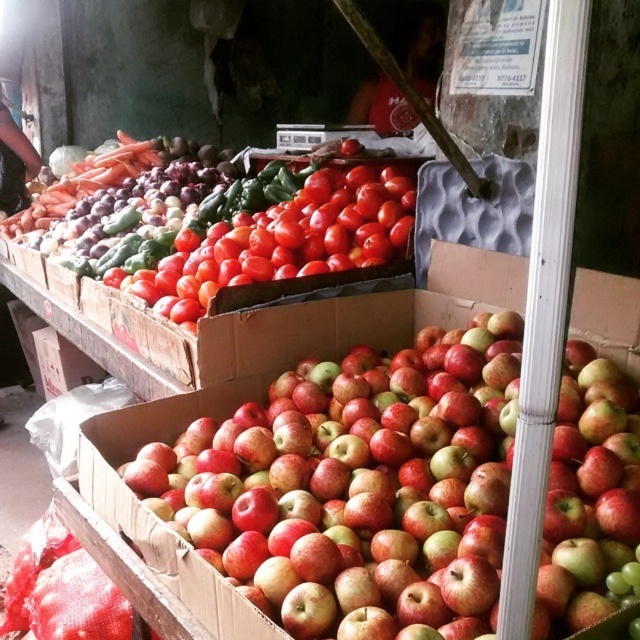
Does red matte apples at center have a smaller size compared to shiny red tomatoes at center?

Actually, red matte apples at center might be larger than shiny red tomatoes at center.

Can you confirm if red matte apples at center is wider than shiny red tomatoes at center?

Yes, red matte apples at center is wider than shiny red tomatoes at center.

Looking at this image, who is more distant from viewer, (636,406) or (244,269)?

The point (244,269) is behind.

Where is `red matte apples at center`? red matte apples at center is located at coordinates (353, 481).